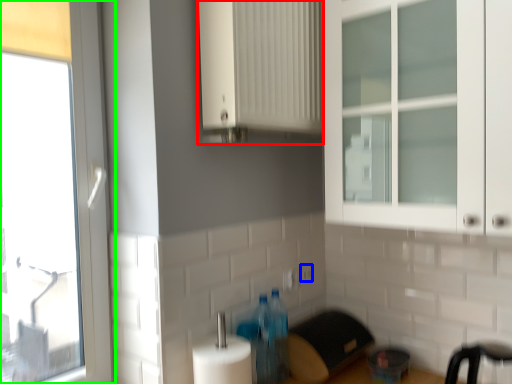
Question: Which object is the closest to the cabinetry (highlighted by a red box)? Choose among these: electric outlet (highlighted by a blue box) or window (highlighted by a green box).

Choices:
 (A) electric outlet
 (B) window

Answer: (B)